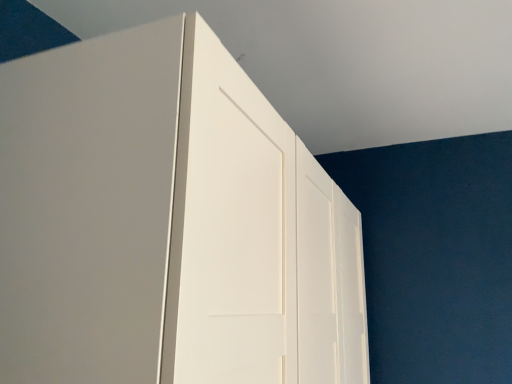
This screenshot has width=512, height=384. What do you see at coordinates (254, 239) in the screenshot?
I see `white matte cabinet at center` at bounding box center [254, 239].

Locate an element on the screen. The height and width of the screenshot is (384, 512). white matte cabinet at center is located at coordinates (254, 239).

At what (x,y) coordinates should I click in order to perform the action: click on white matte cabinet at center. Please return your answer as a coordinate pair (x, y). The width and height of the screenshot is (512, 384). Looking at the image, I should click on (254, 239).